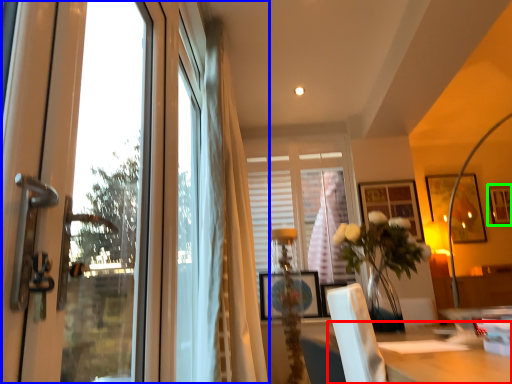
Question: Estimate the real-world distances between objects in this image. Which object is closer to table (highlighted by a red box), window (highlighted by a blue box) or picture frame (highlighted by a green box)?

Choices:
 (A) window
 (B) picture frame

Answer: (A)